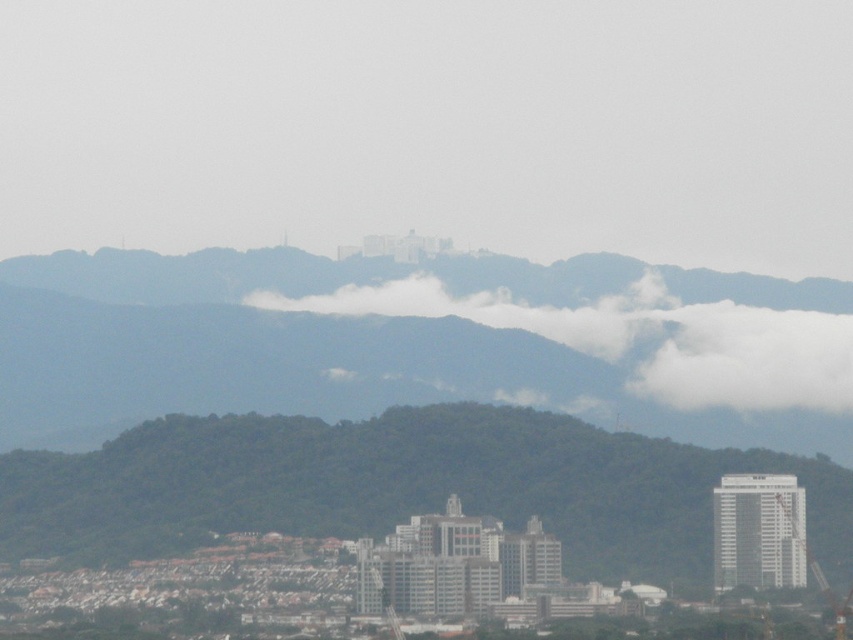
You are an architect designing a new city park. You want to place a large statue on the highest point of the green leafy hill at center so it can be seen from the white fluffy cloud at center. Is the statue visible from there?

The green leafy hill at center is located below the white fluffy cloud at center, so the statue placed on the highest point of the green leafy hill at center would be visible from the white fluffy cloud at center as it is positioned above it.

You are a city planner reviewing this urban design. You need to determine if the green leafy hill at center can be used as a natural barrier against strong winds coming from the direction of the white fluffy cloud at center. Based on their sizes, what would you advise?

The green leafy hill at center is bigger than the white fluffy cloud at center, so it can effectively act as a natural barrier against the wind coming from that direction.